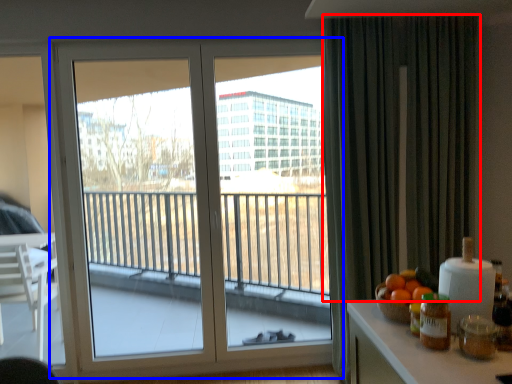
Question: Which point is closer to the camera, curtain (highlighted by a red box) or window (highlighted by a blue box)?

Choices:
 (A) curtain
 (B) window

Answer: (A)